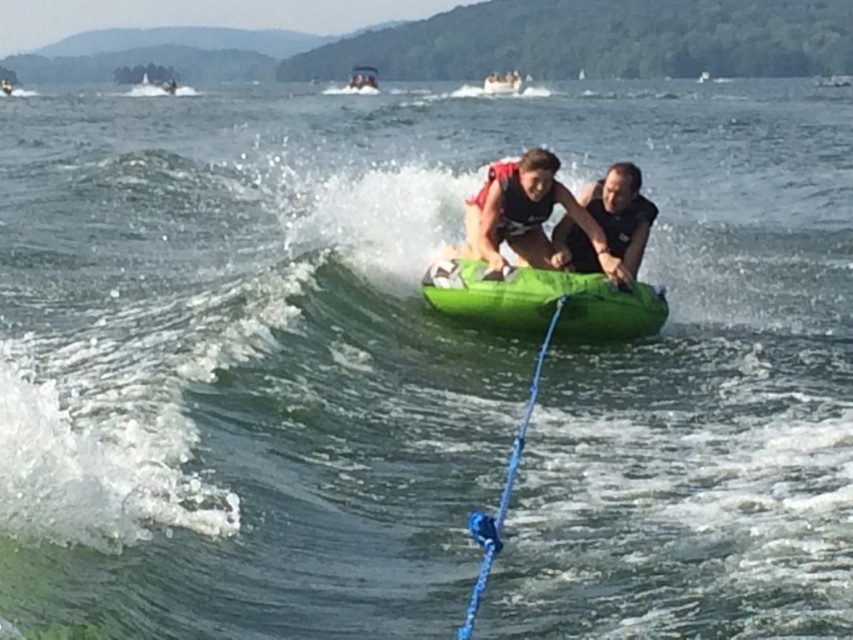
You are navigating a boat and need to drop an anchor. You have two points marked on your map as potential locations. The first is at point (527, 211) and the second at point (364, 65). According to the scene, which point is closer to the boat? Remember, the boat is pulling the tube with two people.

Point (527, 211) is in front of point (364, 65), so the boat is closer to point (527, 211) since it is in front of the other point.

You are standing on the dock and see the matte green tube at center floating on the water. If you want to throw a life ring to it, and the life ring has a throwing range of 12 meters, will you be able to reach it?

The matte green tube at center is 12.70 meters away from the viewer, which exceeds the life ring throwing range of 12 meters. Therefore, you cannot reach it with the life ring.

You are a safety officer monitoring the water activities. You notice two points marked on your radar corresponding to the two individuals on the inflatable tube. The first point is at coordinate point(563, 218) and the second at point(368, 77). Based on their positions, which point corresponds to the person steering the tube?

Point(563, 218) is in front of point(368, 77), so the person at point(563, 218) is steering the tube since they are positioned in front.